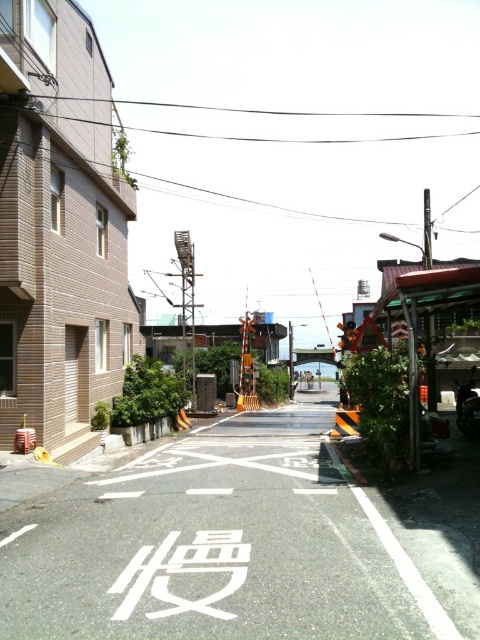
Is white asphalt bike lane at center wider than black plastic traffic light at center?

No.

Does point (420, 484) come in front of point (348, 346)?

Yes, it is in front of point (348, 346).

Does point (48, 532) come farther from viewer compared to point (345, 333)?

No, it is in front of (345, 333).

This screenshot has height=640, width=480. Identify the location of white asphalt bike lane at center. (239, 540).